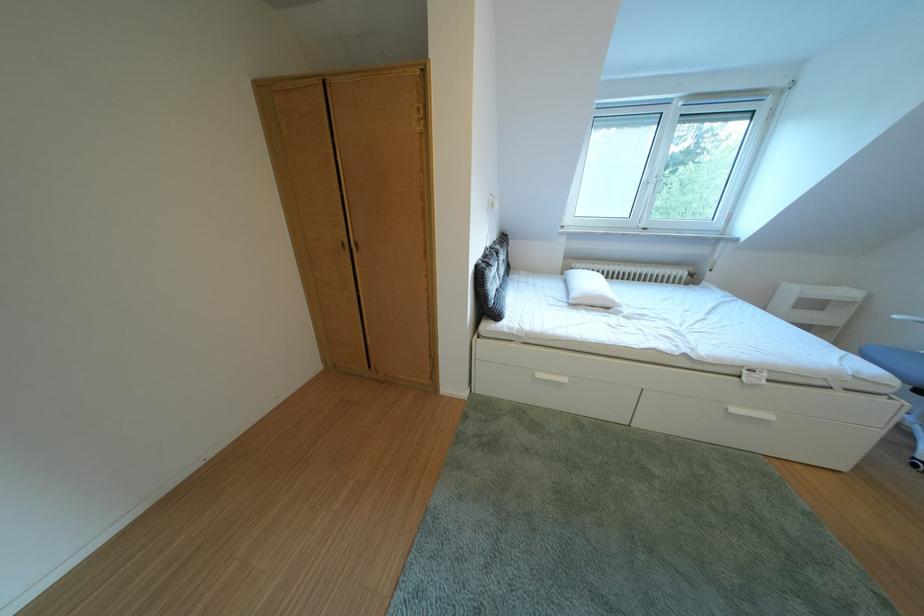
Locate an element on the screen. This screenshot has width=924, height=616. dark cushion is located at coordinates (496, 262).